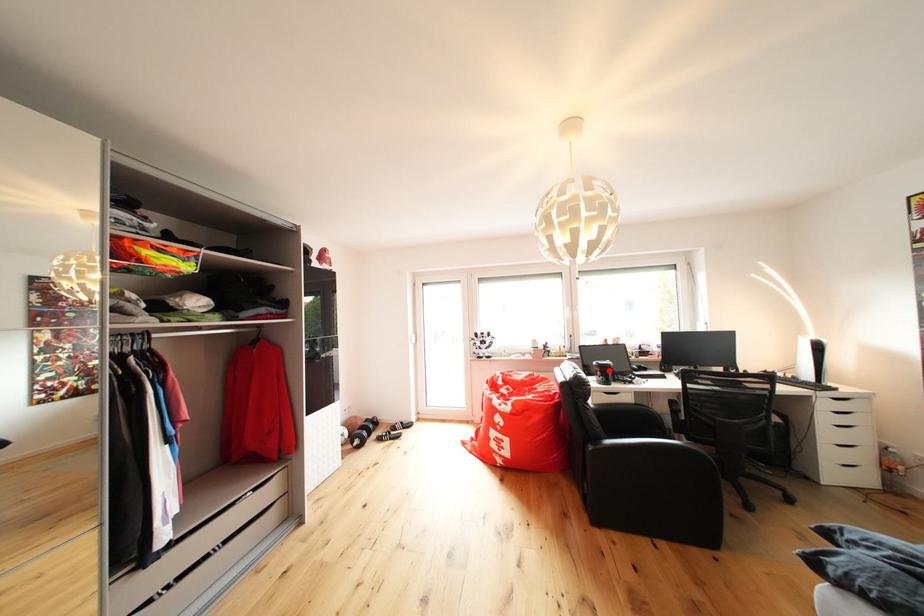
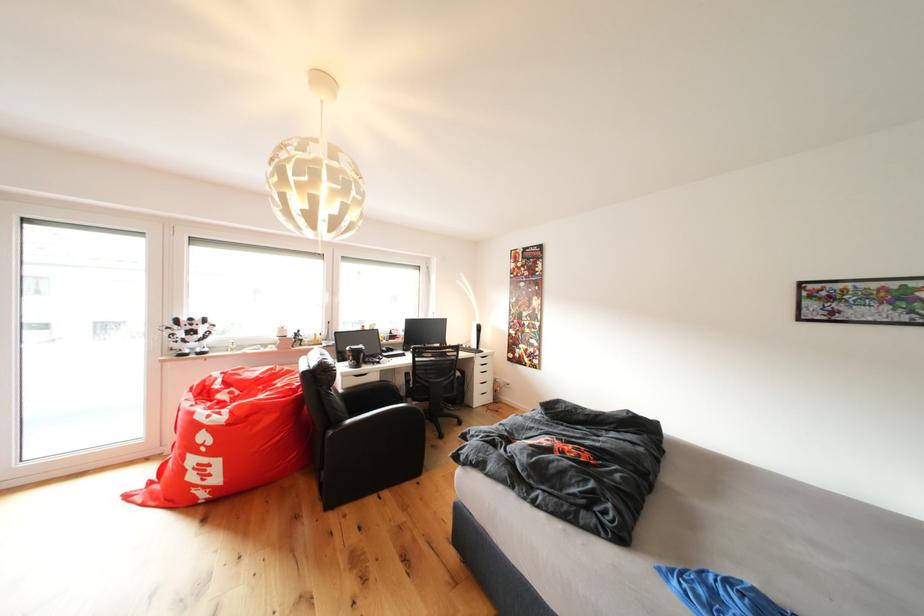
In the second image, find the point that corresponds to the highlighted location in the first image.

(361, 355)